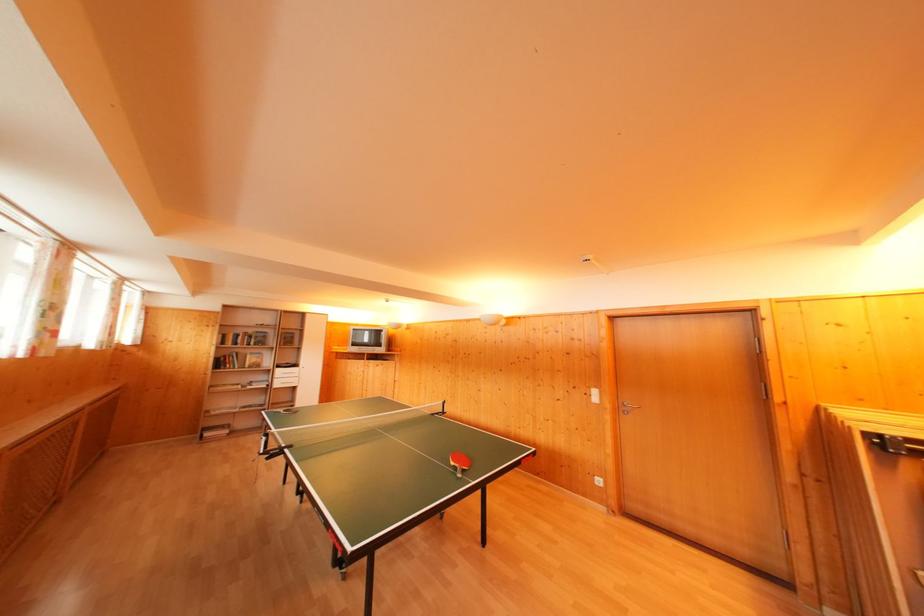
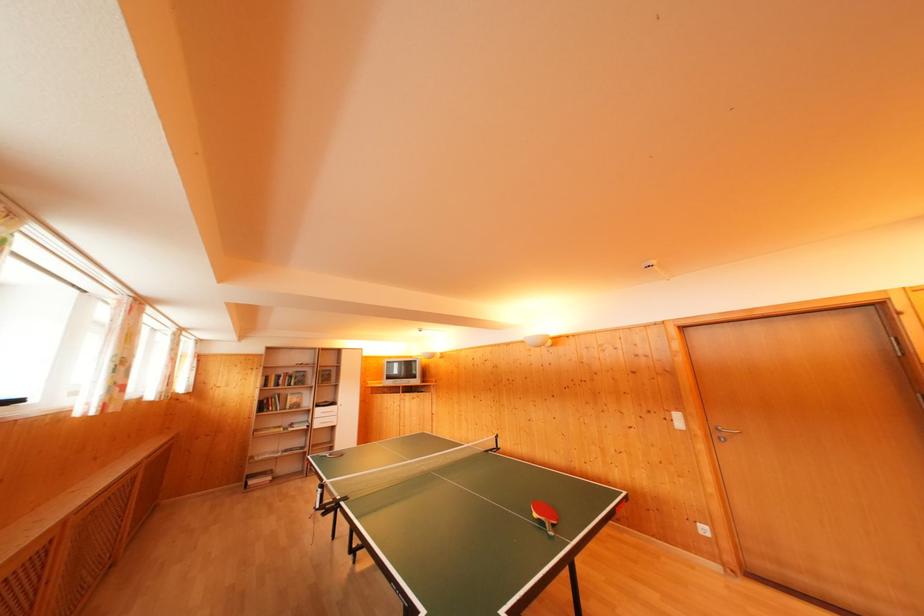
Locate, in the second image, the point that corresponds to [225,368] in the first image.

(268, 411)